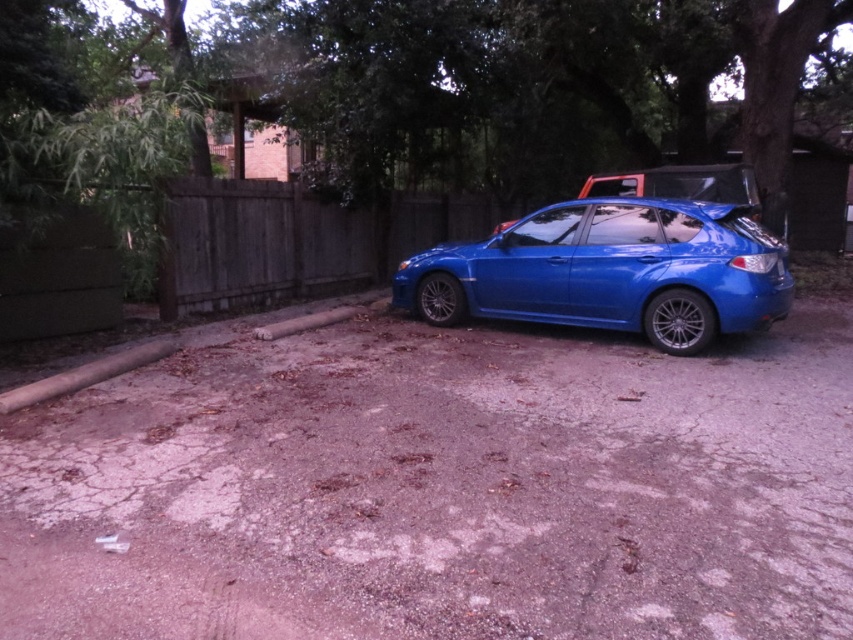
Looking at this image, you are a delivery person needing to drive a large truck through the driveway. The truck is 2 meters wide. The dirt track at center and wooden fence at center are both on the driveway. Which path is wider and can accommodate the truck?

The dirt track at center is wider than the wooden fence at center, so the dirt track at center can accommodate the truck since its width surpasses the truck width of 2 meters.

You are a delivery driver who needs to turn around your blue compact car parked on the driveway. There is a dirt track at center and a wooden fence at center in your view. Which object will you use as a reference to ensure you have enough space to maneuver your car?

The dirt track at center has a larger size compared to the wooden fence at center, so you should use the dirt track at center as a reference to ensure there is sufficient space to maneuver the car.